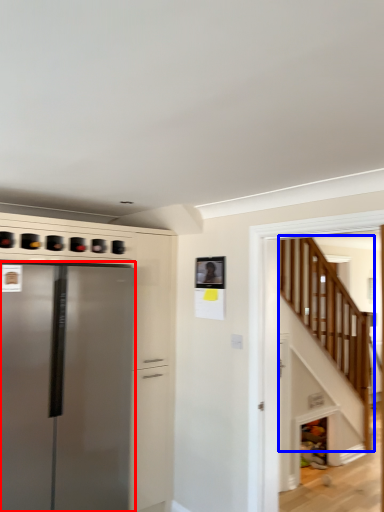
Question: Which of the following is the closest to the observer, refrigerator (highlighted by a red box) or stairwell (highlighted by a blue box)?

Choices:
 (A) refrigerator
 (B) stairwell

Answer: (B)